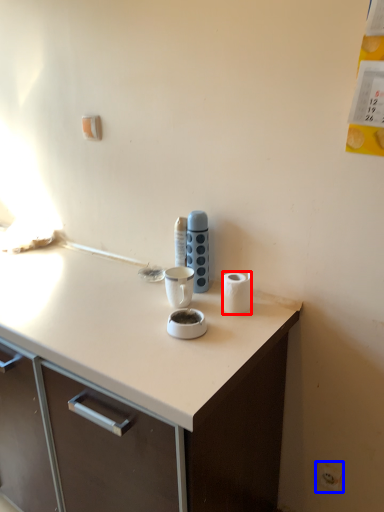
Question: Among these objects, which one is nearest to the camera, paper towel (highlighted by a red box) or electric outlet (highlighted by a blue box)?

Choices:
 (A) paper towel
 (B) electric outlet

Answer: (A)